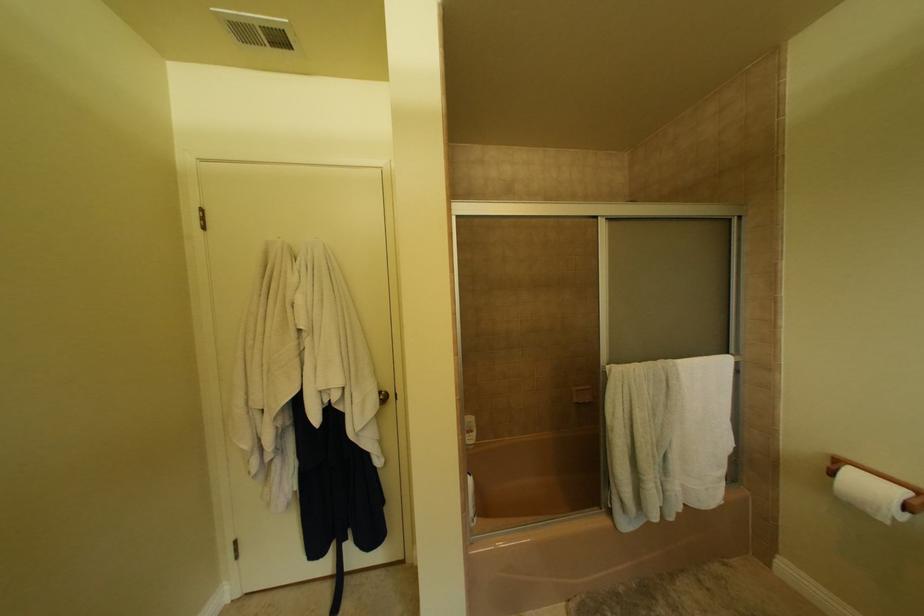
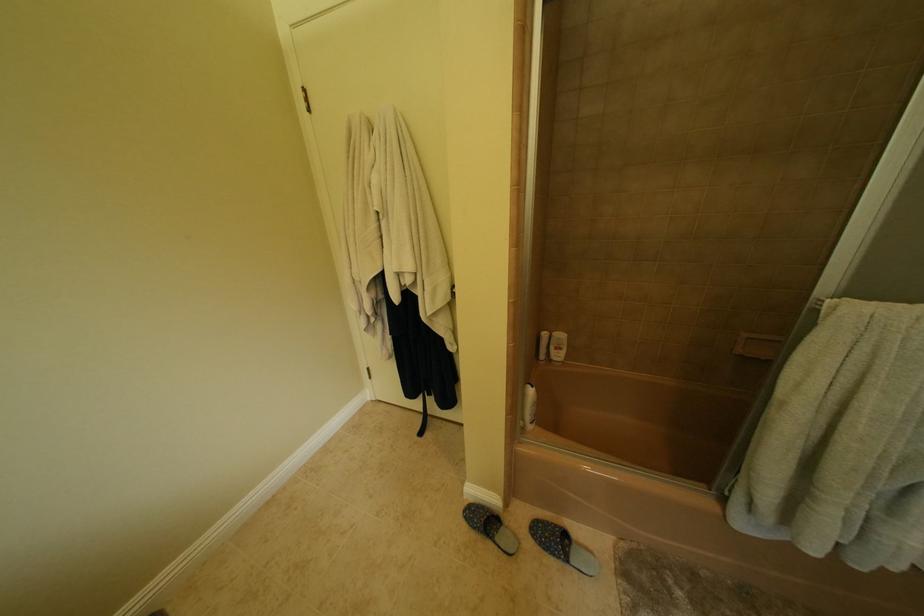
First-person continuous shooting, in which direction is the camera rotating?

The camera rotated toward left-down.